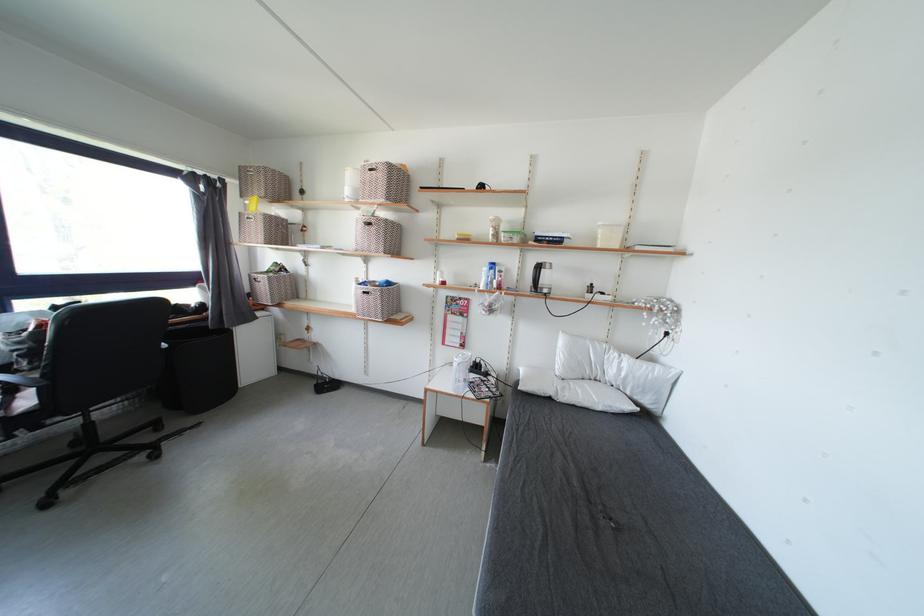
What do you see at coordinates (614, 525) in the screenshot?
I see `the sofa sitting surface` at bounding box center [614, 525].